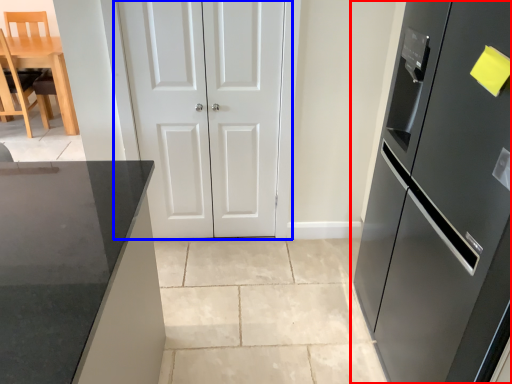
Question: Which object appears closest to the camera in this image, refrigerator (highlighted by a red box) or door (highlighted by a blue box)?

Choices:
 (A) refrigerator
 (B) door

Answer: (A)